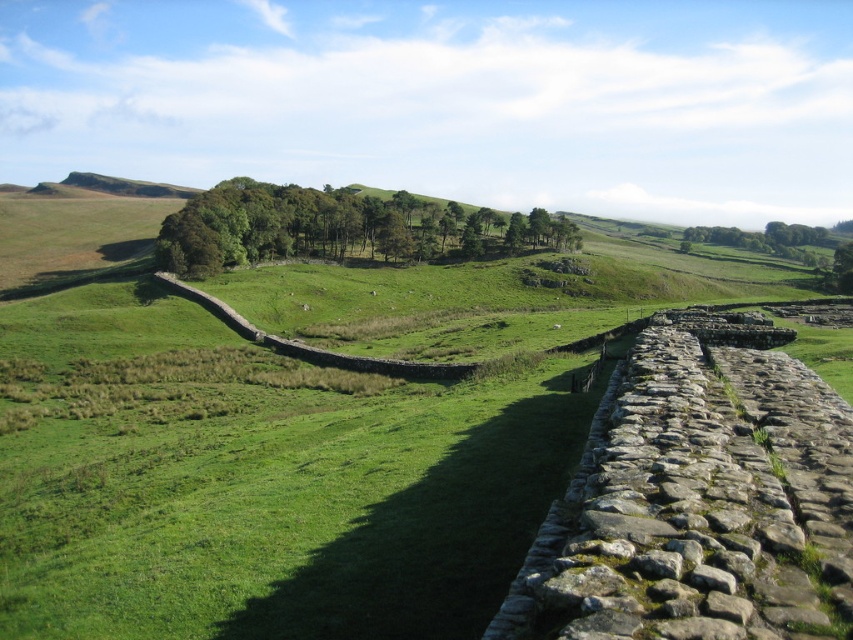
You are standing in the rural landscape and want to take a photo of the green grass at center and the green leafy trees at center. Which object will appear closer to the camera in the photo?

The green grass at center will appear closer to the camera because it is in front of the green leafy trees at center.